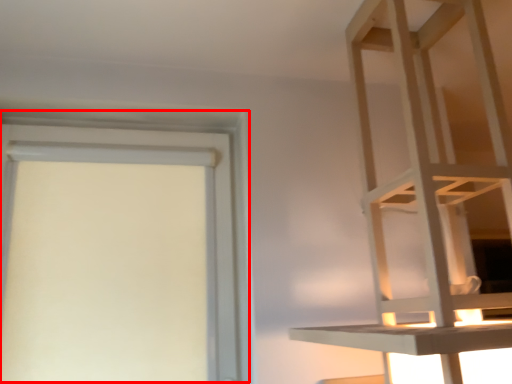
Question: From the image's perspective, what is the correct spatial relationship of bay window (annotated by the red box) in relation to furniture?

Choices:
 (A) below
 (B) above

Answer: (A)